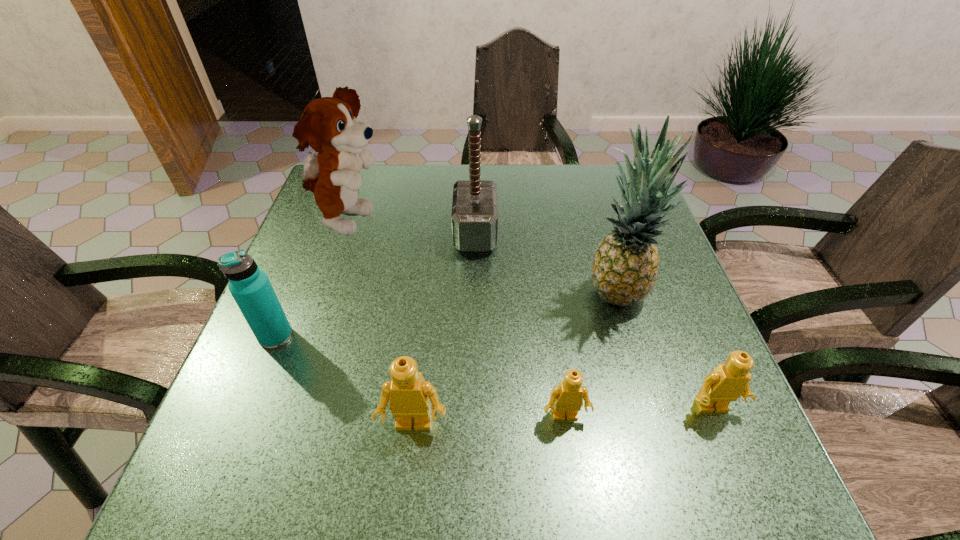
Locate an element on the screen. the leftmost Lego is located at coordinates (409, 395).

Where is `the shortest Lego`? This screenshot has width=960, height=540. the shortest Lego is located at coordinates (567, 397).

Image resolution: width=960 pixels, height=540 pixels. I want to click on the fifth object from left to right, so click(x=567, y=397).

This screenshot has height=540, width=960. I want to click on the rightmost Lego, so tap(727, 382).

Image resolution: width=960 pixels, height=540 pixels. Find the location of `the second shortest Lego`. the second shortest Lego is located at coordinates (727, 382).

Locate an element on the screen. puppy is located at coordinates click(329, 125).

Identify the location of hammer. (474, 216).

What are the coordinates of `the fourth nearest object` in the screenshot? It's located at (250, 286).

Find the location of `water bottle`. water bottle is located at coordinates (250, 286).

Locate an element on the screen. pineapple is located at coordinates coord(625,267).